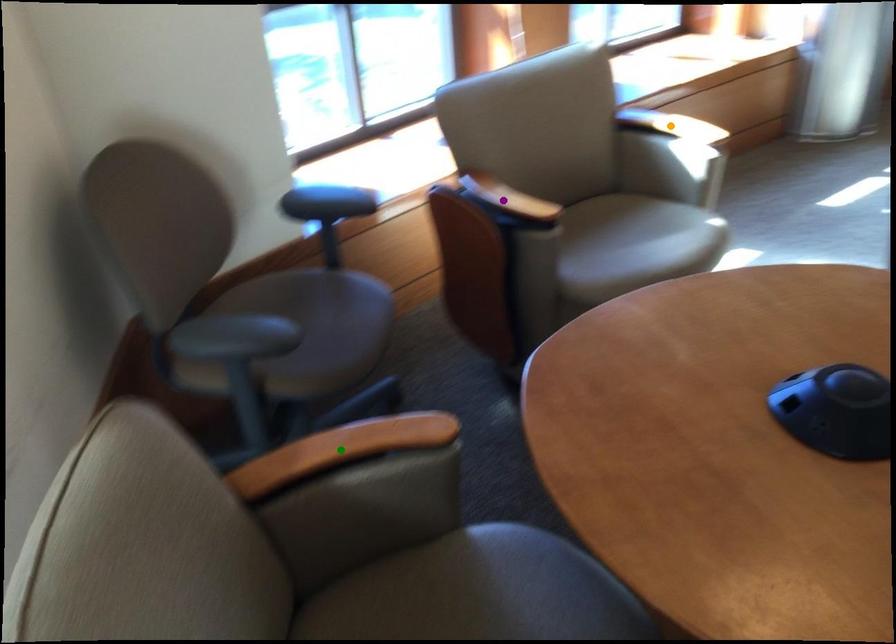
Order these from nearest to farthest:
orange point | green point | purple point

green point, purple point, orange point